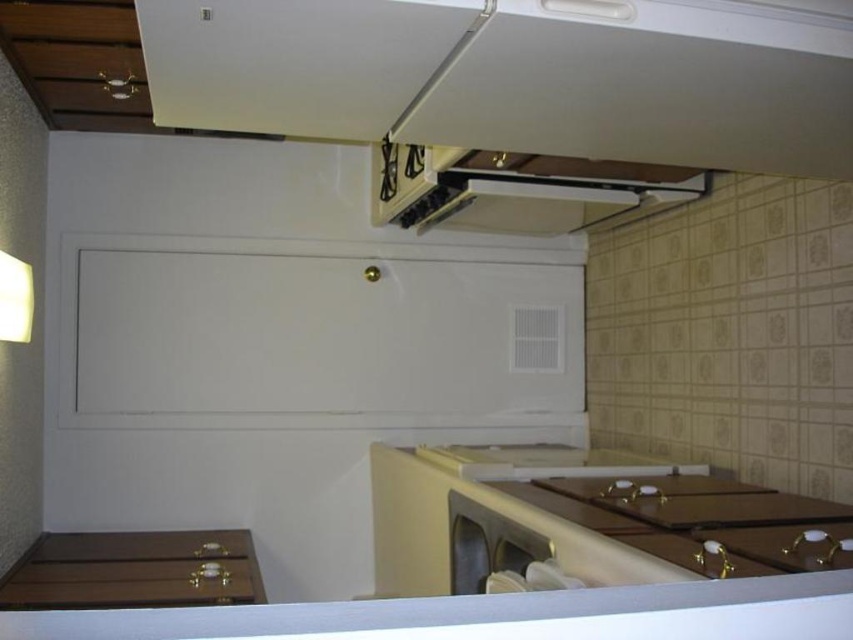
Question: Is white glossy exhaust hood at upper center closer to camera compared to satin silver dishwasher at lower center?

Choices:
 (A) no
 (B) yes

Answer: (A)

Question: Is white glossy exhaust hood at upper center behind satin silver dishwasher at lower center?

Choices:
 (A) no
 (B) yes

Answer: (B)

Question: Which point is closer to the camera taking this photo?

Choices:
 (A) click(590, 198)
 (B) click(490, 512)

Answer: (B)

Question: Can you confirm if white glossy exhaust hood at upper center is positioned to the left of satin silver dishwasher at lower center?

Choices:
 (A) yes
 (B) no

Answer: (B)